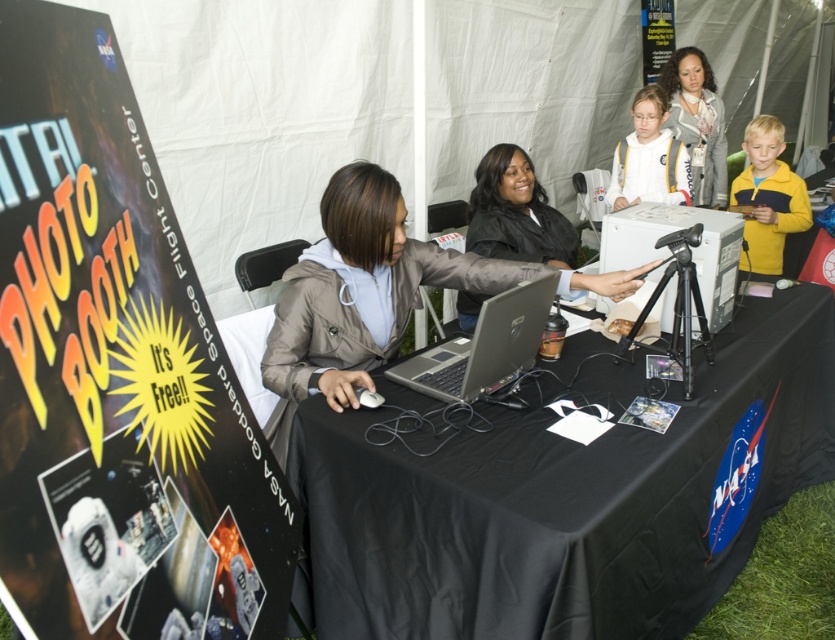
Question: Among these objects, which one is farthest from the camera?

Choices:
 (A) white fabric vest at upper center
 (B) matte gray hoodie at upper center

Answer: (B)

Question: Which of the following is the closest to the observer?

Choices:
 (A) yellow fleece jacket at right
 (B) silver metallic laptop at center

Answer: (B)

Question: Can you confirm if black fabric table at center is positioned below silver metallic laptop at center?

Choices:
 (A) yes
 (B) no

Answer: (A)

Question: Is yellow fleece jacket at right positioned behind matte gray hoodie at upper center?

Choices:
 (A) no
 (B) yes

Answer: (A)

Question: Can you confirm if yellow fleece jacket at right is thinner than white fabric vest at upper center?

Choices:
 (A) no
 (B) yes

Answer: (A)

Question: Considering the real-world distances, which object is farthest from the yellow fleece jacket at right?

Choices:
 (A) white fabric vest at upper center
 (B) black fabric table at center
 (C) silver metallic laptop at center
 (D) matte gray hoodie at upper center

Answer: (C)